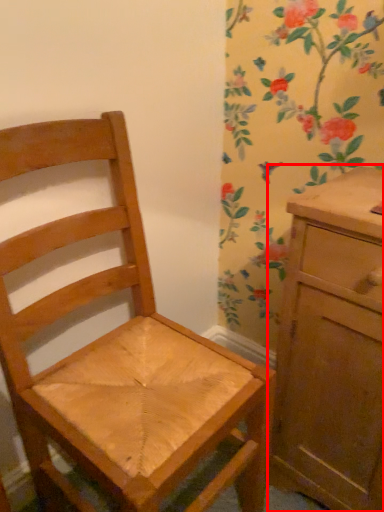
Question: From the image's perspective, where is chest of drawers (annotated by the red box) located in relation to chair in the image?

Choices:
 (A) below
 (B) above

Answer: (A)